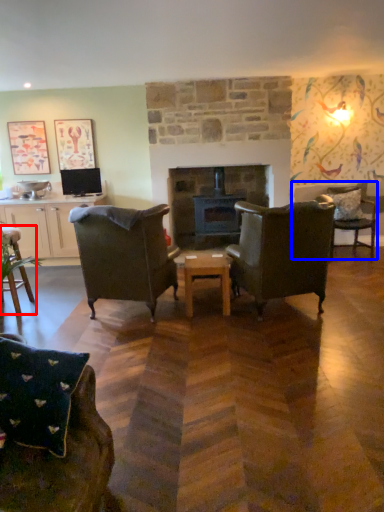
Question: Which of the following is the closest to the observer, chair (highlighted by a red box) or chair (highlighted by a blue box)?

Choices:
 (A) chair
 (B) chair

Answer: (A)